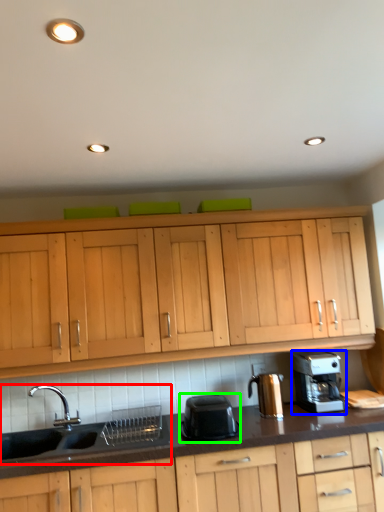
Question: Based on their relative distances, which object is farther from sink (highlighted by a red box)? Choose from home appliance (highlighted by a blue box) and kitchen appliance (highlighted by a green box).

Choices:
 (A) home appliance
 (B) kitchen appliance

Answer: (A)